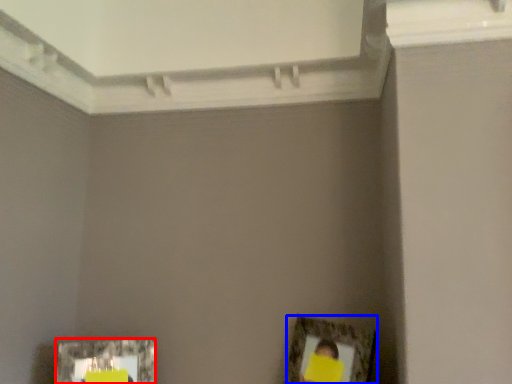
Question: Among these objects, which one is nearest to the camera, picture frame (highlighted by a red box) or picture frame (highlighted by a blue box)?

Choices:
 (A) picture frame
 (B) picture frame

Answer: (B)